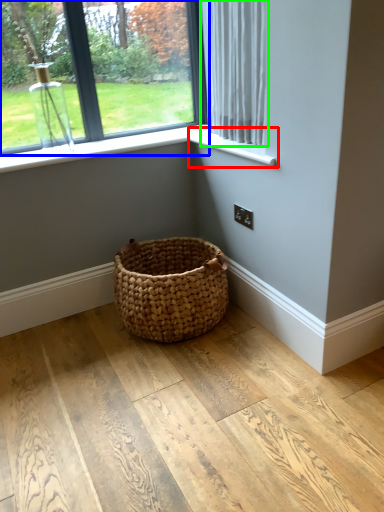
Question: Based on their relative distances, which object is farther from window sill (highlighted by a red box)? Choose from window (highlighted by a blue box) and curtain (highlighted by a green box).

Choices:
 (A) window
 (B) curtain

Answer: (A)